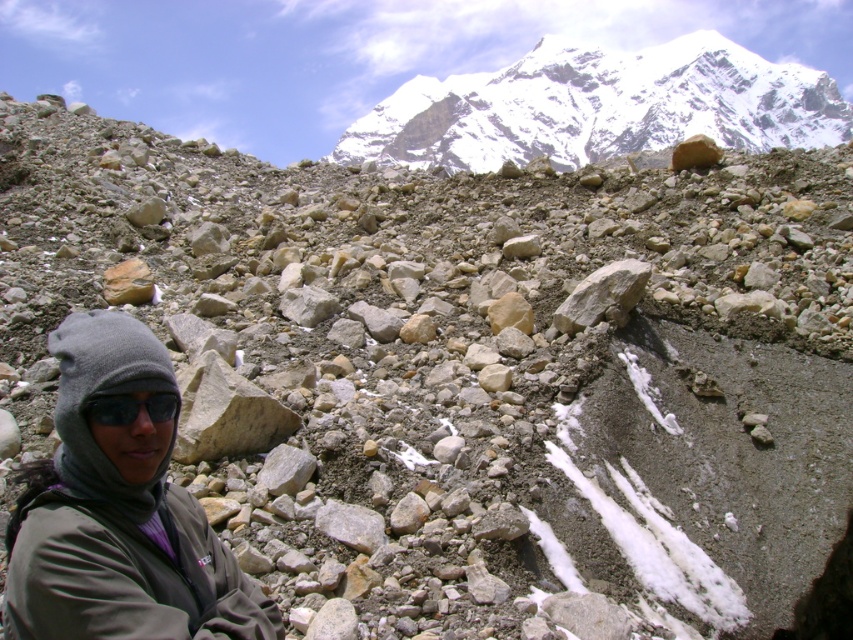
Question: Does gray fleece jacket at lower left appear under snowy granite peak at upper center?

Choices:
 (A) no
 (B) yes

Answer: (B)

Question: Considering the relative positions of gray fleece jacket at lower left and snowy granite peak at upper center in the image provided, where is gray fleece jacket at lower left located with respect to snowy granite peak at upper center?

Choices:
 (A) above
 (B) below

Answer: (B)

Question: Which object appears farthest from the camera in this image?

Choices:
 (A) black matte goggles at lower left
 (B) snowy granite peak at upper center
 (C) gray fleece jacket at lower left

Answer: (B)

Question: Is gray fleece jacket at lower left below black matte goggles at lower left?

Choices:
 (A) no
 (B) yes

Answer: (B)

Question: Which point is farther to the camera?

Choices:
 (A) snowy granite peak at upper center
 (B) black matte goggles at lower left

Answer: (A)

Question: Which point is farther to the camera?

Choices:
 (A) black matte goggles at lower left
 (B) gray fleece jacket at lower left

Answer: (A)